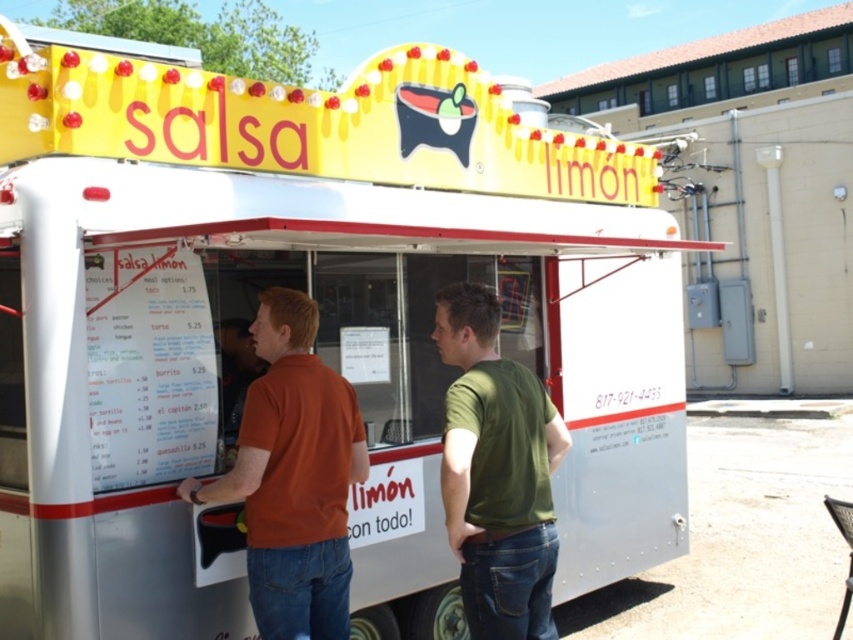
Question: From the image, what is the correct spatial relationship of orange cotton shirt at center in relation to green matte shirt at center?

Choices:
 (A) left
 (B) right

Answer: (A)

Question: Is orange cotton shirt at center to the left of green matte shirt at center from the viewer's perspective?

Choices:
 (A) no
 (B) yes

Answer: (B)

Question: Does orange cotton shirt at center have a smaller size compared to green matte shirt at center?

Choices:
 (A) yes
 (B) no

Answer: (B)

Question: Which point is farther from the camera taking this photo?

Choices:
 (A) (462, 528)
 (B) (256, 509)

Answer: (B)

Question: Which of the following is the farthest from the observer?

Choices:
 (A) (520, 390)
 (B) (265, 513)

Answer: (B)

Question: Which of the following is the closest to the observer?

Choices:
 (A) (296, 550)
 (B) (474, 589)

Answer: (B)